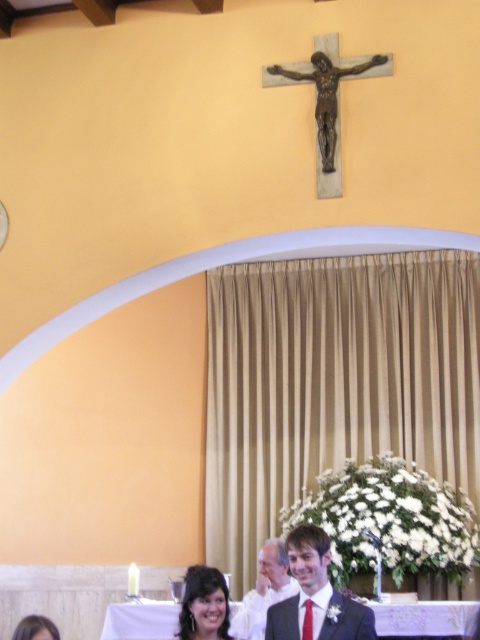
You are standing in the church and see the matte black hair at lower center and the matte black suit at lower center. Which one is positioned more to the left side?

The matte black hair at lower center is positioned more to the left side than the matte black suit at lower center.

In the scene shown: You are a photographer standing in front of the altar. You want to take a picture of the two people in matte black hair at lower center and matte black suit at lower center. The camera you have can only focus on objects within a 5 feet range. Will both subjects be in focus?

A: The matte black hair at lower center and matte black suit at lower center are 5.96 feet apart, so they are outside the camera focus range of 5 feet. Therefore, both subjects cannot be in focus at the same time.

You are standing in the church and want to take a photo of the crucifix. There is a person wearing a matte black suit at center in your way. Based on their position, can you estimate if you can move to your left or right to get a clear shot of the crucifix without the person blocking it?

The matte black suit at center is located at coordinates approximately 0.931 on the x axis and 0.658 on the y axis. Since the crucifix is positioned above the altar on the yellow wall, moving to either the left or right side might allow you to avoid the person blocking the view. However, without knowing the exact dimensions of the space and the person, it is difficult to determine the best direction with certainty.